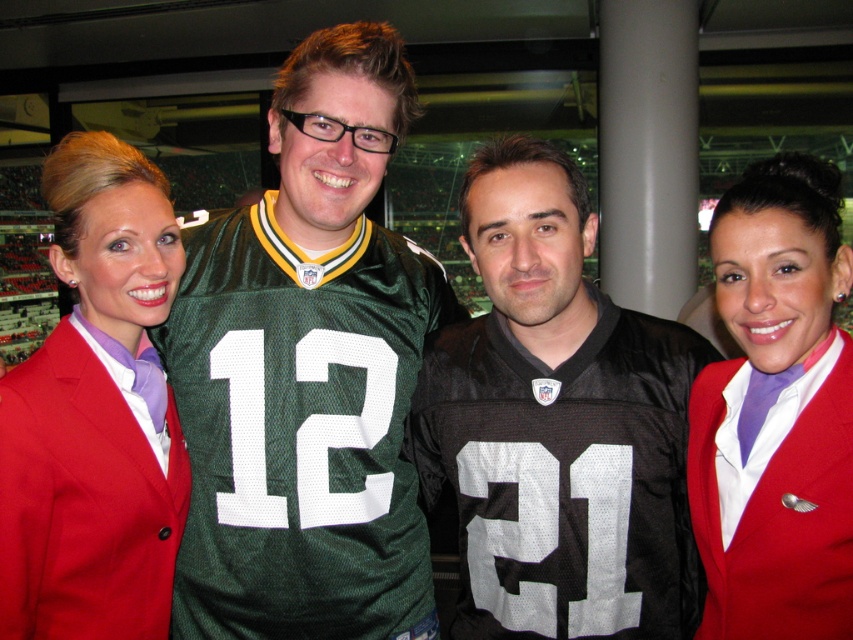
Is green jersey at center shorter than black jersey at center?

In fact, green jersey at center may be taller than black jersey at center.

Who is positioned more to the right, green jersey at center or black jersey at center?

From the viewer's perspective, black jersey at center appears more on the right side.

Is point (190, 285) behind point (604, 381)?

Yes, it is behind point (604, 381).

Where is `green jersey at center`? green jersey at center is located at coordinates (306, 371).

Is point (634, 536) closer to viewer compared to point (741, 218)?

No, (634, 536) is further to viewer.

Is black jersey at center below matte red blazer at center?

Yes.

Who is more distant from viewer, (596, 605) or (747, 243)?

Point (596, 605)

The image size is (853, 640). What are the coordinates of `black jersey at center` in the screenshot? It's located at (556, 422).

Does green jersey at center have a larger size compared to matte red blazer at center?

Indeed, green jersey at center has a larger size compared to matte red blazer at center.

Between green jersey at center and matte red blazer at center, which one is positioned lower?

matte red blazer at center

Who is more forward, [422,540] or [809,524]?

Point [809,524] is in front.

You are a GUI agent. You are given a task and a screenshot of the screen. Output one action in this format:
    pyautogui.click(x=<x>, y=<y>)
    Task: Click on the green jersey at center
    The height and width of the screenshot is (640, 853).
    Given the screenshot: What is the action you would take?
    pyautogui.click(x=306, y=371)